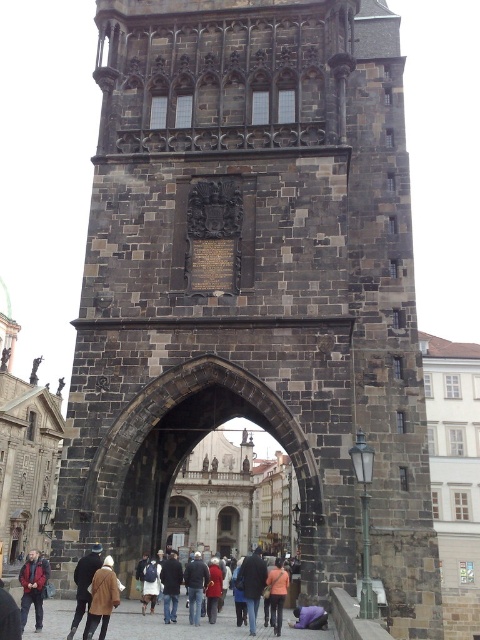
Can you confirm if brown wool coat at lower left is positioned above dark blue jacket at center?

Yes.

Can you confirm if brown wool coat at lower left is positioned to the left of dark blue jacket at center?

Indeed, brown wool coat at lower left is positioned on the left side of dark blue jacket at center.

Find the location of a particular element. This screenshot has width=480, height=640. brown wool coat at lower left is located at coordinates click(103, 596).

Is dark brown leather jacket at lower left taller than orange fabric jacket at lower center?

Yes, dark brown leather jacket at lower left is taller than orange fabric jacket at lower center.

Is point (19, 576) behind point (276, 588)?

Yes, point (19, 576) is farther from viewer.

Where is `dark brown leather jacket at lower left`? The image size is (480, 640). dark brown leather jacket at lower left is located at coordinates (33, 588).

Between dark brown leather jacket at lower left and dark blue jeans at center, which one has less height?

With less height is dark brown leather jacket at lower left.

In the scene shown: Can you confirm if dark brown leather jacket at lower left is positioned to the left of dark blue jeans at center?

Yes, dark brown leather jacket at lower left is to the left of dark blue jeans at center.

Which is in front, point (40, 563) or point (263, 577)?

Point (263, 577)

Where is `dark brown leather jacket at lower left`? Image resolution: width=480 pixels, height=640 pixels. dark brown leather jacket at lower left is located at coordinates (33, 588).